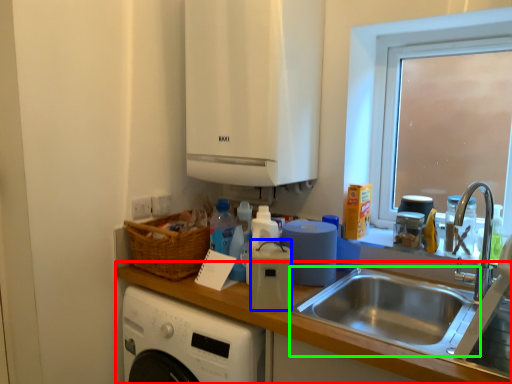
Question: Which object is the closest to the countertop (highlighted by a red box)? Choose among these: appliance (highlighted by a blue box) or sink (highlighted by a green box).

Choices:
 (A) appliance
 (B) sink

Answer: (A)